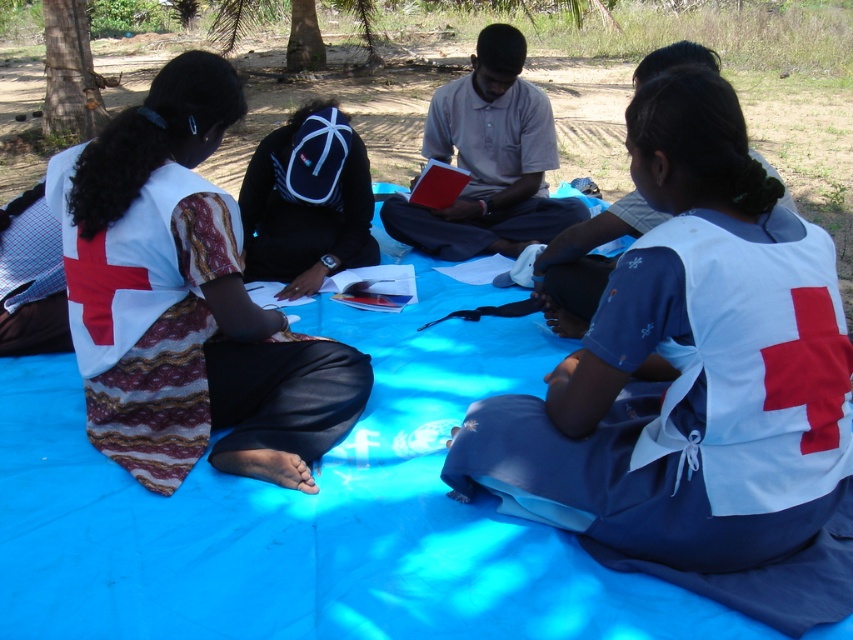
Measure the distance from light gray cotton shirt at center to white fabric shirt at upper right.

They are 31.68 inches apart.

Where is `light gray cotton shirt at center`? The width and height of the screenshot is (853, 640). light gray cotton shirt at center is located at coordinates (488, 160).

Between point (567, 218) and point (688, 64), which one is positioned in front?

Point (688, 64) is in front.

This screenshot has width=853, height=640. I want to click on light gray cotton shirt at center, so click(488, 160).

Which is below, white fabric shirt at left or navy blue backpack at center?

white fabric shirt at left is below.

Between white fabric shirt at left and navy blue backpack at center, which one has less height?

navy blue backpack at center

Who is more forward, (267, 394) or (316, 116)?

Point (267, 394) is in front.

Find the location of a particular element. The height and width of the screenshot is (640, 853). white fabric shirt at left is located at coordinates (186, 301).

Does white fabric vest at center appear on the right side of white fabric shirt at left?

Correct, you'll find white fabric vest at center to the right of white fabric shirt at left.

Who is lower down, white fabric vest at center or white fabric shirt at left?

white fabric vest at center is lower down.

Where is `white fabric vest at center`? The width and height of the screenshot is (853, 640). white fabric vest at center is located at coordinates (693, 360).